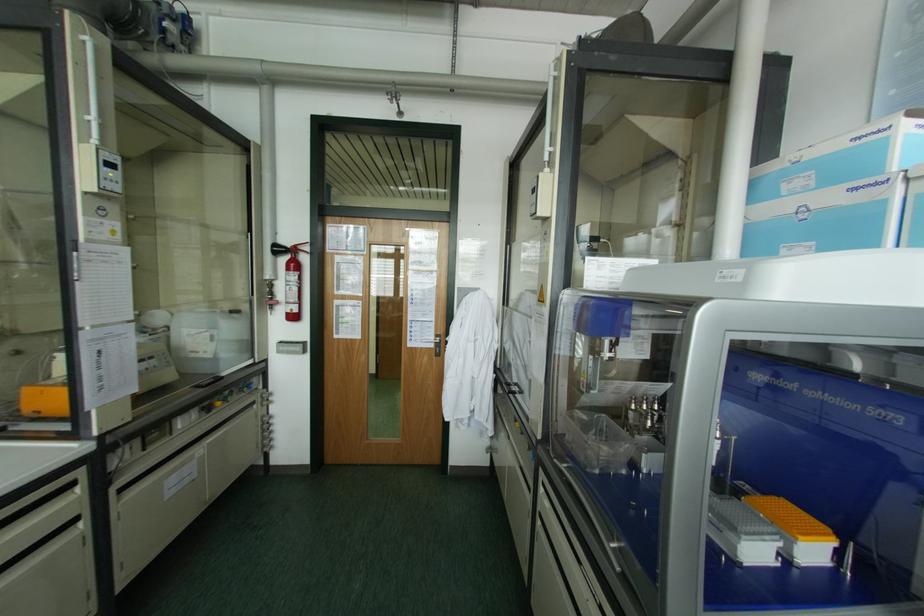
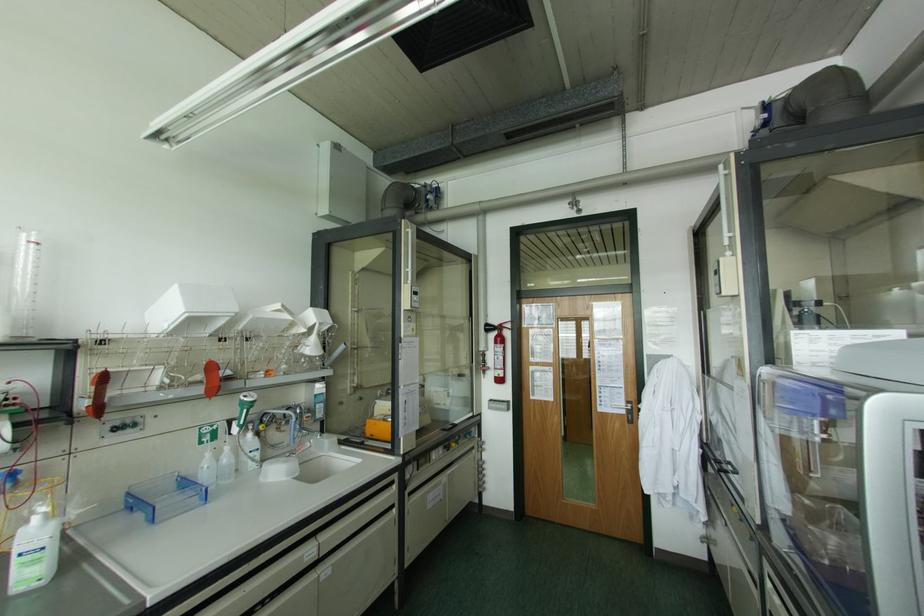
Where in the second image is the point corresponding to pixel 307 248 from the first image?

(507, 325)